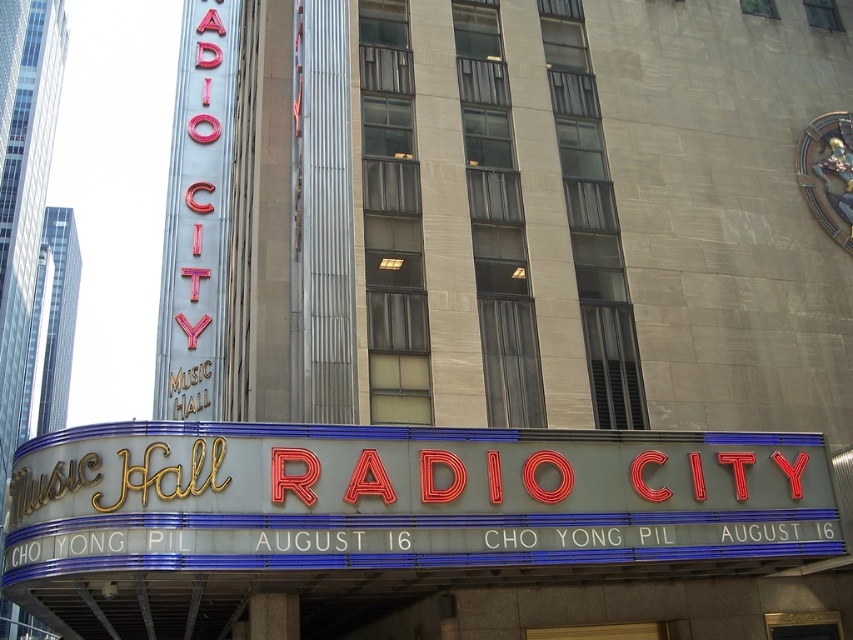
You are standing in front of Radio City Music Hall and notice two neon red signs. The first one is the neon red sign at center, and the second is the neon red sign at left. Which of these two signs is positioned lower on the building?

The neon red sign at center is located below neon red sign at left, so the neon red sign at center is positioned lower on the building.

You are standing in front of Radio City Music Hall and notice two neon red signs. The first is the neon red sign at center, and the second is the neon red sign at left. Which of these two signs is taller?

The neon red sign at left is taller than the neon red sign at center.